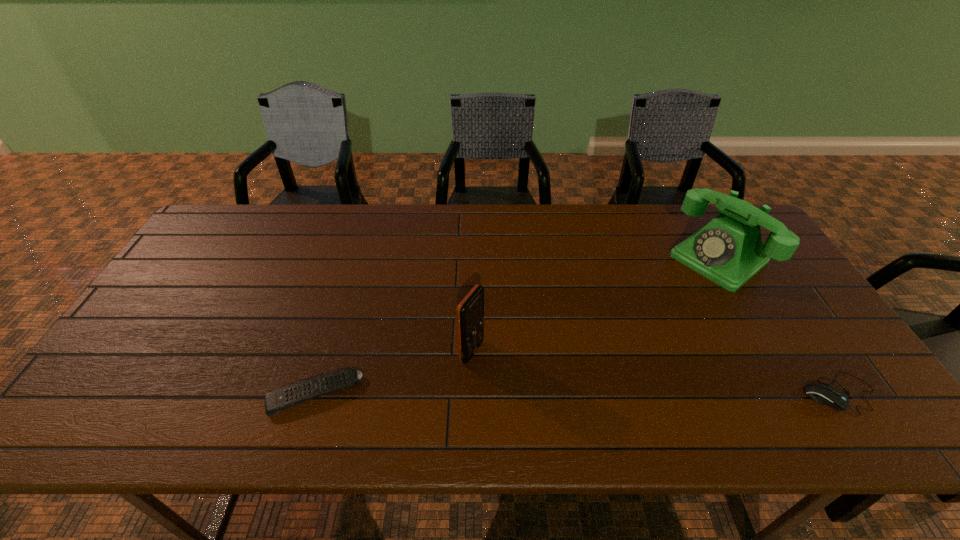
This screenshot has width=960, height=540. Identify the location of object located at the near right corner. (833, 397).

Locate an element on the screen. free location at the far edge of the desktop is located at coordinates (390, 233).

The height and width of the screenshot is (540, 960). Find the location of `free space at the near edge of the desktop`. free space at the near edge of the desktop is located at coordinates (750, 393).

In the image, there is a desktop. Identify the location of vacant space at the left edge. The width and height of the screenshot is (960, 540). (202, 288).

Find the location of `vacant area at the far left corner of the desktop`. vacant area at the far left corner of the desktop is located at coordinates (251, 233).

I want to click on blank area at the near left corner, so click(132, 395).

At what (x,y) coordinates should I click in order to perform the action: click on free space between the second farthest object and the leftmost object. Please return your answer as a coordinate pair (x, y). The height and width of the screenshot is (540, 960). Looking at the image, I should click on (393, 373).

What are the coordinates of `free space between the third tallest object and the second object from left to right` in the screenshot? It's located at (656, 373).

Image resolution: width=960 pixels, height=540 pixels. In order to click on free space between the third nearest object and the third tallest object in this screenshot , I will do `click(656, 373)`.

You are a GUI agent. You are given a task and a screenshot of the screen. Output one action in this format:
    pyautogui.click(x=<x>, y=<y>)
    Task: Click on the vacant area that lies between the second object from left to right and the computer mouse
    
    Given the screenshot: What is the action you would take?
    pyautogui.click(x=656, y=373)